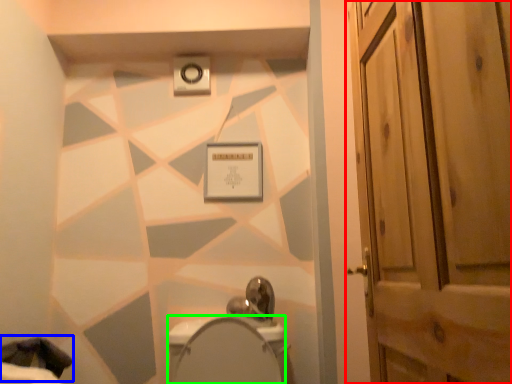
Question: Estimate the real-world distances between objects in this image. Which object is farther from door (highlighted by a red box), laundry (highlighted by a blue box) or bidet (highlighted by a green box)?

Choices:
 (A) laundry
 (B) bidet

Answer: (A)